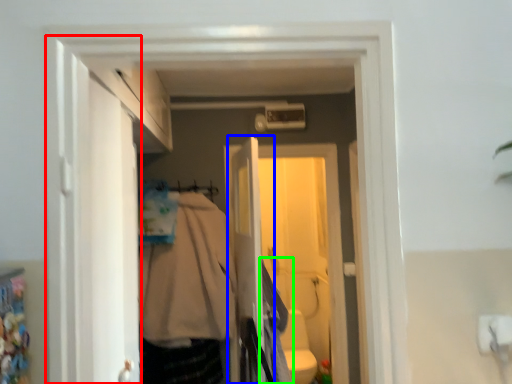
Question: Which object is the farthest from door (highlighted by a red box)? Choose among these: screen door (highlighted by a blue box) or clothing (highlighted by a green box).

Choices:
 (A) screen door
 (B) clothing

Answer: (B)